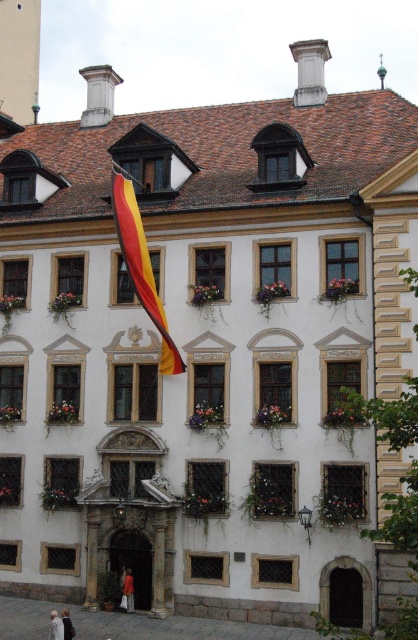
You are standing in front of the building and see the red fabric flag at upper left and the light beige coat at lower left. Which object is located to the right of the other?

The red fabric flag at upper left is positioned on the right side of light beige coat at lower left.